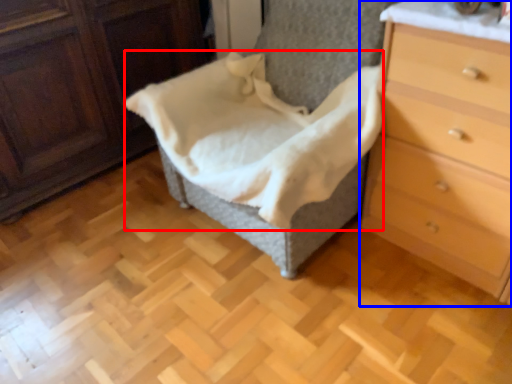
Question: Which of the following is the farthest to the observer, blanket (highlighted by a red box) or chest of drawers (highlighted by a blue box)?

Choices:
 (A) blanket
 (B) chest of drawers

Answer: (A)